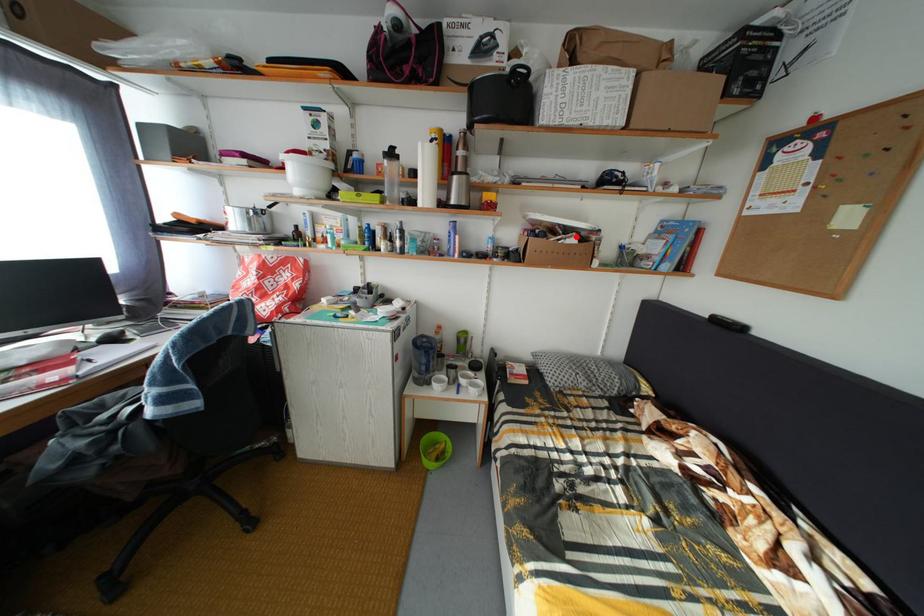
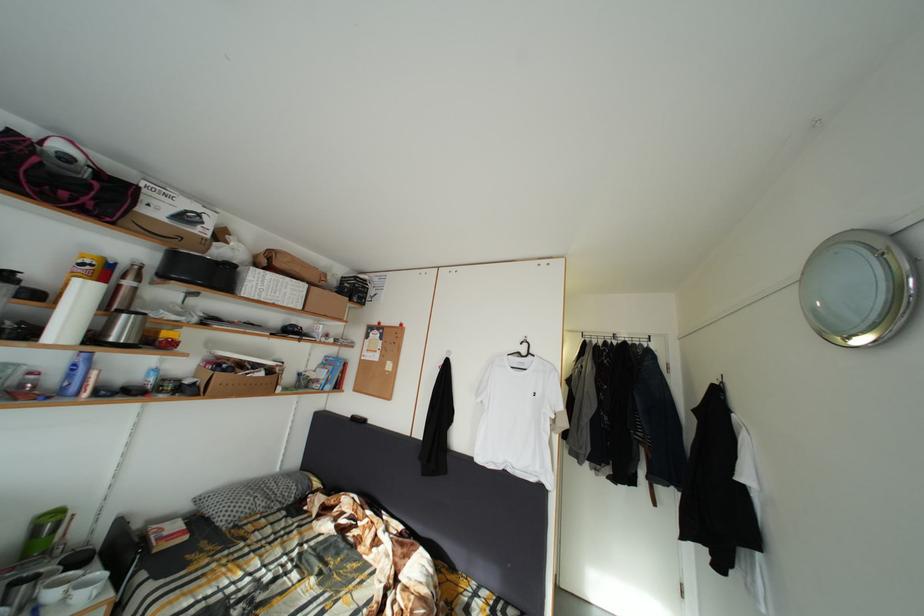
In the second image, find the point that corresponds to the highlighted location in the first image.

(264, 373)